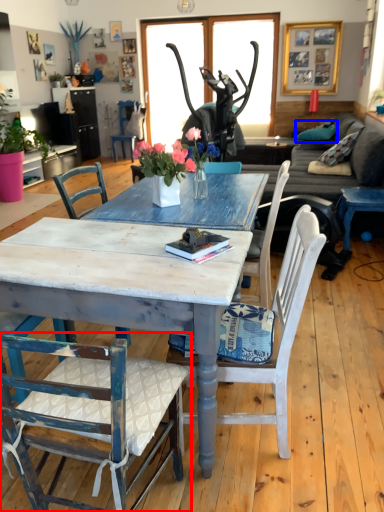
Question: Which of the following is the farthest to the observer, chair (highlighted by a red box) or pillow (highlighted by a blue box)?

Choices:
 (A) chair
 (B) pillow

Answer: (B)